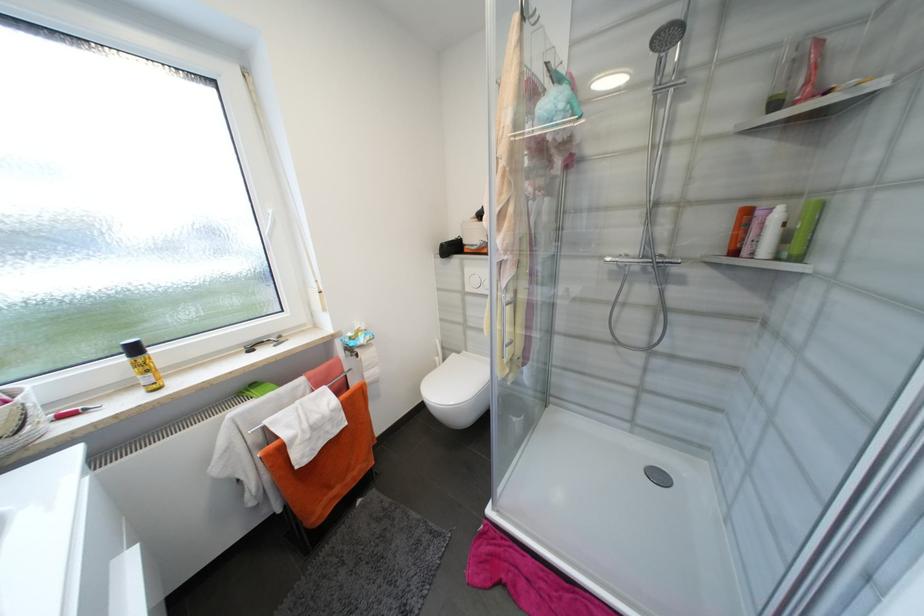
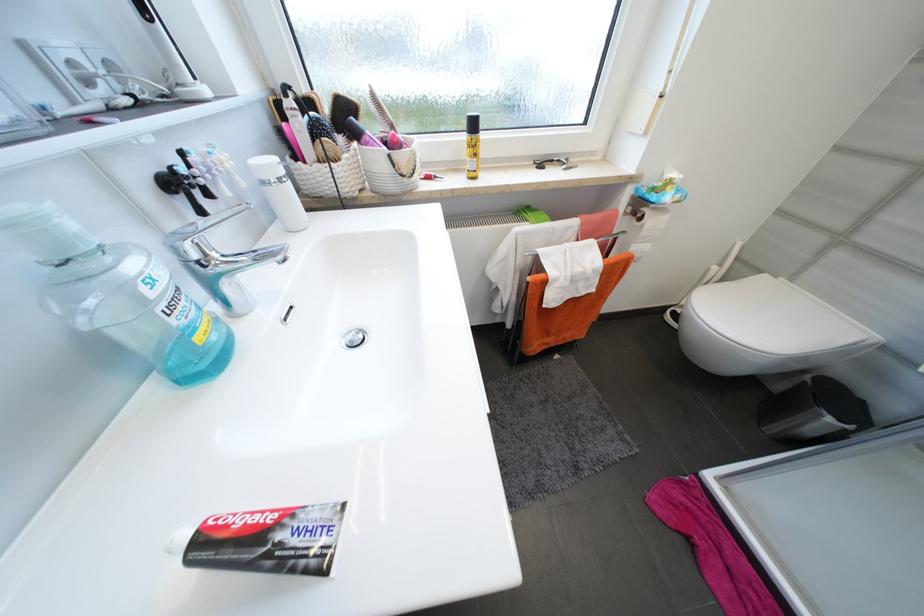
Where in the second image is the point corresponding to (x=520, y=419) from the first image?

(834, 421)